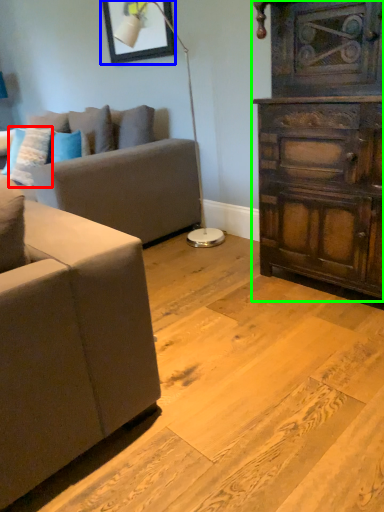
Question: Which object is the closest to the pillow (highlighted by a red box)? Choose among these: picture frame (highlighted by a blue box) or chest of drawers (highlighted by a green box).

Choices:
 (A) picture frame
 (B) chest of drawers

Answer: (A)